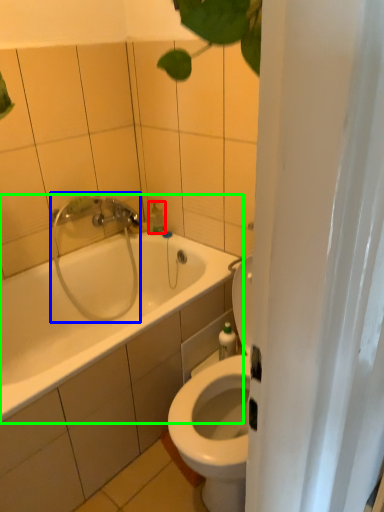
Question: Estimate the real-world distances between objects in this image. Which object is closer to soap dispenser (highlighted by a red box), shower (highlighted by a blue box) or bathtub (highlighted by a green box)?

Choices:
 (A) shower
 (B) bathtub

Answer: (A)